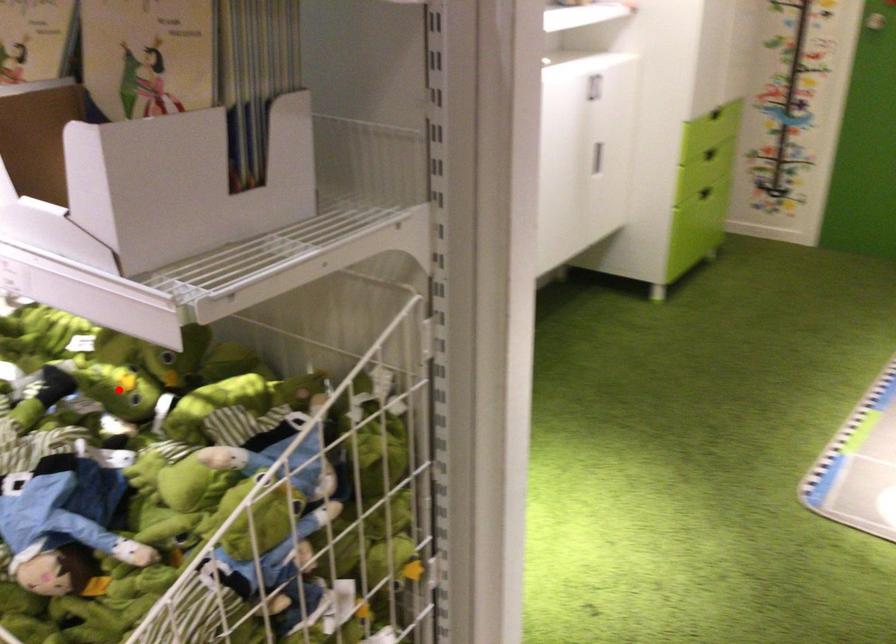
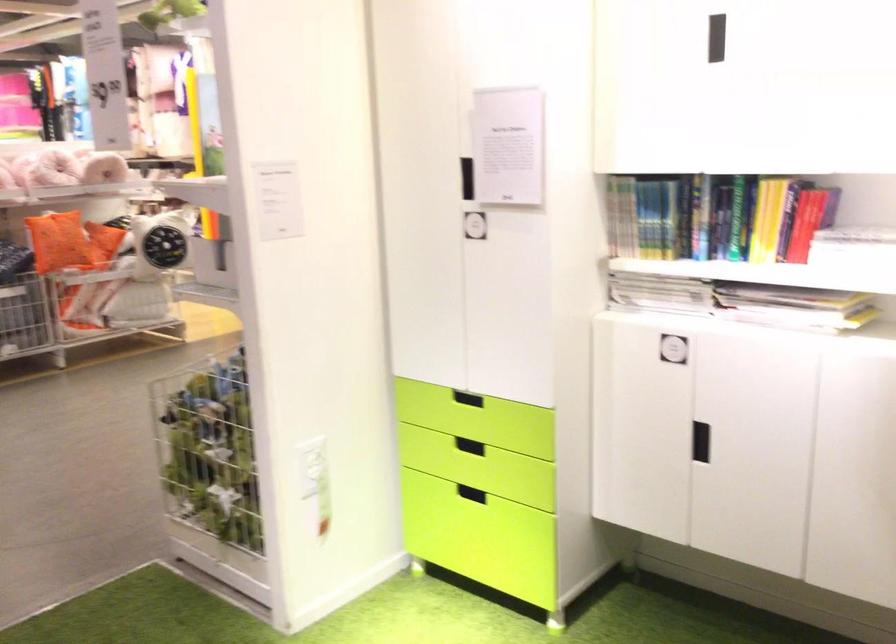
Question: I am providing you with two images of the same scene from different viewpoints. A red point is marked on the first image. Is the red point's position out of view in image 2?

Choices:
 (A) Yes
 (B) No

Answer: (A)